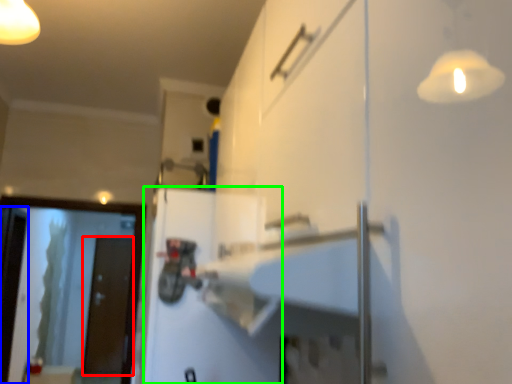
Question: Considering the real-world distances, which object is farthest from door (highlighted by a red box)? screen door (highlighted by a blue box) or door (highlighted by a green box)?

Choices:
 (A) screen door
 (B) door

Answer: (B)